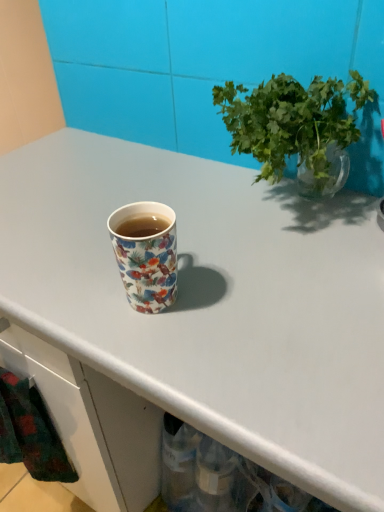
What do you see at coordinates (30, 432) in the screenshot? I see `flannel fabric blanket at lower left` at bounding box center [30, 432].

Find the location of a particular element. flannel fabric blanket at lower left is located at coordinates (30, 432).

Locate an element on the screen. The image size is (384, 512). flannel fabric blanket at lower left is located at coordinates (30, 432).